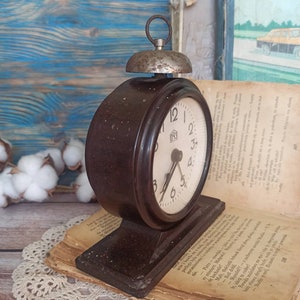
You are a GUI agent. You are given a task and a screenshot of the screen. Output one action in this format:
    pyautogui.click(x=<x>, y=<y>)
    Task: Click on the doily
    
    Given the screenshot: What is the action you would take?
    pyautogui.click(x=33, y=285)